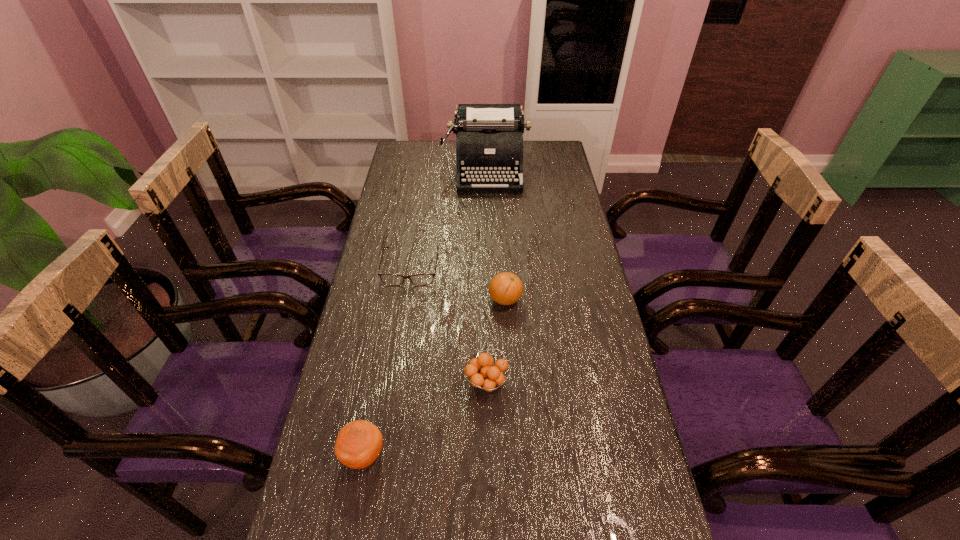
Locate an element on the screen. vacant space in between the second nearest object and the third farthest object is located at coordinates (496, 341).

At what (x,y) coordinates should I click in order to perform the action: click on vacant space in between the fourth farthest object and the farthest orange fruit. Please return your answer as a coordinate pair (x, y). The width and height of the screenshot is (960, 540). Looking at the image, I should click on (496, 341).

Select which object is the third closest to the second nearest orange fruit. Please provide its 2D coordinates. Your answer should be formatted as a tuple, i.e. [(x, y)], where the tuple contains the x and y coordinates of a point satisfying the conditions above.

[(389, 279)]

Choose which object is the nearest neighbor to the third farthest object. Please provide its 2D coordinates. Your answer should be formatted as a tuple, i.e. [(x, y)], where the tuple contains the x and y coordinates of a point satisfying the conditions above.

[(389, 279)]

Identify which orange fruit is the second nearest to the farthest orange fruit. Please provide its 2D coordinates. Your answer should be formatted as a tuple, i.e. [(x, y)], where the tuple contains the x and y coordinates of a point satisfying the conditions above.

[(359, 443)]

Where is `orange fruit that is the second closest to the typewriter`? orange fruit that is the second closest to the typewriter is located at coordinates (482, 373).

The width and height of the screenshot is (960, 540). What are the coordinates of `vacant position in the image that satisfies the following two spatial constraints: 1. on the typing side of the tallest object; 2. on the left side of the farthest orange fruit` in the screenshot? It's located at (489, 300).

The image size is (960, 540). Find the location of `vacant area in the image that satisfies the following two spatial constraints: 1. on the back side of the farthest orange fruit; 2. on the right side of the nearest object`. vacant area in the image that satisfies the following two spatial constraints: 1. on the back side of the farthest orange fruit; 2. on the right side of the nearest object is located at coordinates (393, 300).

You are a GUI agent. You are given a task and a screenshot of the screen. Output one action in this format:
    pyautogui.click(x=<x>, y=<y>)
    Task: Click on the vacant space that satisfies the following two spatial constraints: 1. on the lenses of the farthest orange fruit; 2. on the left side of the spectacles
    The height and width of the screenshot is (540, 960).
    Given the screenshot: What is the action you would take?
    pyautogui.click(x=406, y=300)

Locate an element on the screen. The width and height of the screenshot is (960, 540). vacant space that satisfies the following two spatial constraints: 1. on the lenses of the third farthest object; 2. on the left side of the second farthest object is located at coordinates (406, 300).